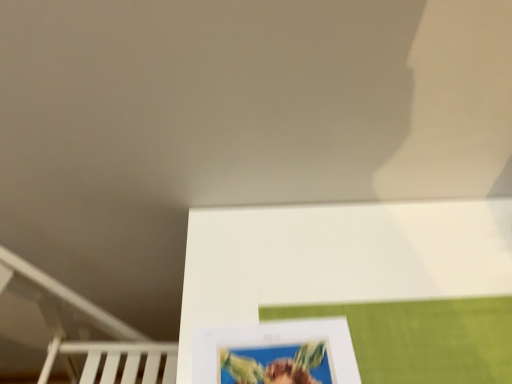
Question: In terms of width, does white matte picture frame at lower center look wider or thinner when compared to white matte bunk bed at lower left?

Choices:
 (A) thin
 (B) wide

Answer: (A)

Question: From the image's perspective, is white matte picture frame at lower center above or below white matte bunk bed at lower left?

Choices:
 (A) above
 (B) below

Answer: (A)

Question: Visually, is white matte picture frame at lower center positioned to the left or to the right of white matte bunk bed at lower left?

Choices:
 (A) left
 (B) right

Answer: (B)

Question: In the image, is white matte bunk bed at lower left positioned in front of or behind white matte picture frame at lower center?

Choices:
 (A) behind
 (B) front

Answer: (A)

Question: Looking at their shapes, would you say white matte bunk bed at lower left is wider or thinner than white matte picture frame at lower center?

Choices:
 (A) thin
 (B) wide

Answer: (B)

Question: Is white matte bunk bed at lower left inside the boundaries of white matte picture frame at lower center, or outside?

Choices:
 (A) outside
 (B) inside

Answer: (A)

Question: Does point (53, 326) appear closer or farther from the camera than point (318, 375)?

Choices:
 (A) closer
 (B) farther

Answer: (B)